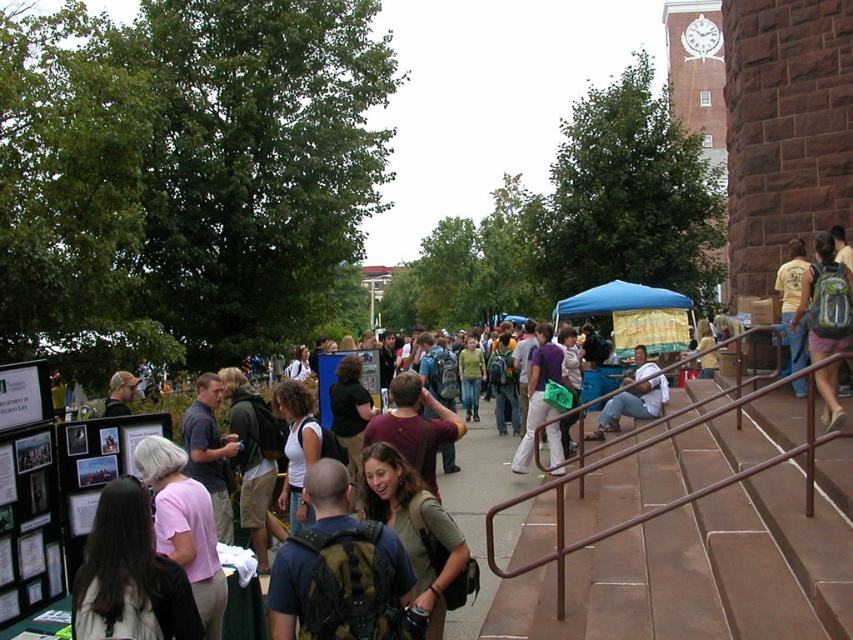
Question: Estimate the real-world distances between objects in this image. Which object is closer to the green backpack at upper right?

Choices:
 (A) light brown backpack at center
 (B) matte black backpack at center
 (C) pink fabric shirt at lower left

Answer: (A)

Question: Which object is positioned farthest from the matte purple shirt at center?

Choices:
 (A) yellow cotton shirt at upper right
 (B) brown metal railing at center

Answer: (A)

Question: Does brown metal railing at center have a lesser width compared to matte black backpack at center?

Choices:
 (A) yes
 (B) no

Answer: (B)

Question: Which object is farther from the camera taking this photo?

Choices:
 (A) brown metal railing at center
 (B) yellow cotton shirt at upper right

Answer: (B)

Question: Is dark brown backpack at lower left smaller than matte purple shirt at center?

Choices:
 (A) no
 (B) yes

Answer: (B)

Question: Is the position of pink fabric shirt at lower left less distant than that of matte purple shirt at center?

Choices:
 (A) yes
 (B) no

Answer: (A)